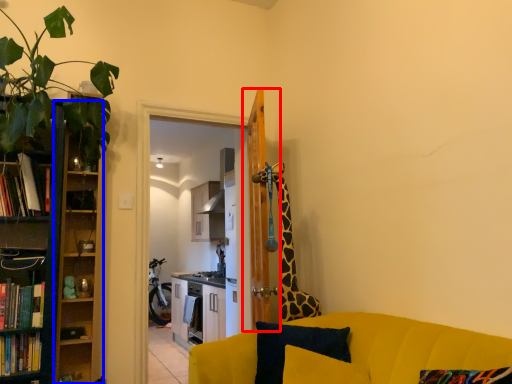
Question: Which object is closer to the camera taking this photo, door (highlighted by a red box) or cabinet (highlighted by a blue box)?

Choices:
 (A) door
 (B) cabinet

Answer: (B)